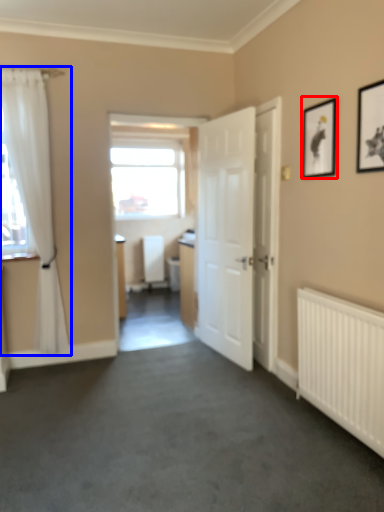
Question: Which object is closer to the camera taking this photo, picture frame (highlighted by a red box) or curtain (highlighted by a blue box)?

Choices:
 (A) picture frame
 (B) curtain

Answer: (A)